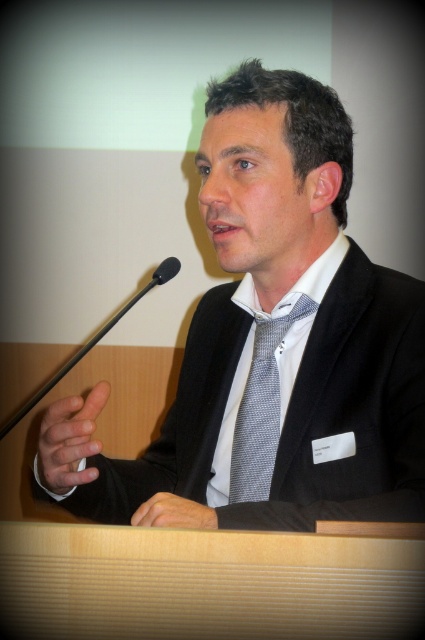
Measure the distance between black textured suit at center and camera.

The distance of black textured suit at center from camera is 67.20 centimeters.

Is black textured suit at center to the right of white textured dress shirt at center from the viewer's perspective?

Correct, you'll find black textured suit at center to the right of white textured dress shirt at center.

Is point (275, 122) positioned before point (283, 369)?

Yes.

The image size is (425, 640). Identify the location of black textured suit at center. (271, 346).

Who is higher up, black textured suit at center or black plastic microphone at left?

black textured suit at center is above.

I want to click on black textured suit at center, so click(271, 346).

Which is behind, point (340, 227) or point (172, 257)?

The point (172, 257) is behind.

Where is `black textured suit at center`? The width and height of the screenshot is (425, 640). black textured suit at center is located at coordinates (271, 346).

Can you confirm if gray dotted tie at center is smaller than black plastic microphone at left?

Yes, gray dotted tie at center is smaller than black plastic microphone at left.

Does gray dotted tie at center have a greater width compared to black plastic microphone at left?

Incorrect, gray dotted tie at center's width does not surpass black plastic microphone at left's.

The image size is (425, 640). What are the coordinates of `gray dotted tie at center` in the screenshot? It's located at 260,410.